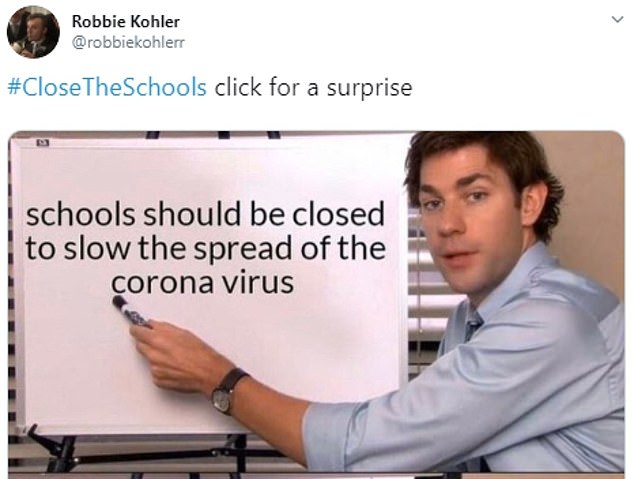
Where is `whiteboard`? whiteboard is located at coordinates (156, 252).